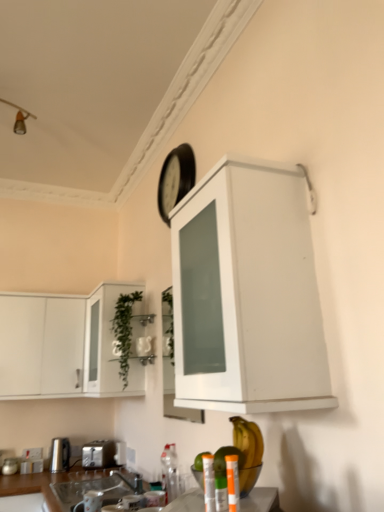
Question: Does green leafy plant at center have a lesser width compared to translucent plastic bottle at lower center, the second bottle viewed from the left?

Choices:
 (A) yes
 (B) no

Answer: (B)

Question: Can you confirm if green leafy plant at center is bigger than translucent plastic bottle at lower center, the 1th bottle viewed from the right?

Choices:
 (A) no
 (B) yes

Answer: (B)

Question: Is green leafy plant at center shorter than translucent plastic bottle at lower center, the 1th bottle viewed from the right?

Choices:
 (A) yes
 (B) no

Answer: (B)

Question: From a real-world perspective, is green leafy plant at center located higher than translucent plastic bottle at lower center, the second bottle viewed from the left?

Choices:
 (A) yes
 (B) no

Answer: (A)

Question: Is green leafy plant at center further to camera compared to translucent plastic bottle at lower center, the second bottle viewed from the left?

Choices:
 (A) no
 (B) yes

Answer: (B)

Question: Is green leafy plant at center not inside translucent plastic bottle at lower center, the 1th bottle viewed from the right?

Choices:
 (A) no
 (B) yes

Answer: (B)

Question: Does silver metallic faucet at lower center appear on the left side of satin silver toaster at lower center, positioned as the 3th appliance in top-to-bottom order?

Choices:
 (A) yes
 (B) no

Answer: (B)

Question: Does silver metallic faucet at lower center have a greater height compared to satin silver toaster at lower center, the 2th appliance when ordered from right to left?

Choices:
 (A) yes
 (B) no

Answer: (B)

Question: Could you tell me if silver metallic faucet at lower center is turned towards satin silver toaster at lower center, the first appliance positioned from the back?

Choices:
 (A) no
 (B) yes

Answer: (A)

Question: Are silver metallic faucet at lower center and satin silver toaster at lower center, the 2th appliance when ordered from right to left, making contact?

Choices:
 (A) no
 (B) yes

Answer: (A)

Question: Could satin silver toaster at lower center, marked as the second appliance in a bottom-to-top arrangement, be considered to be inside silver metallic faucet at lower center?

Choices:
 (A) yes
 (B) no

Answer: (B)

Question: From a real-world perspective, is silver metallic faucet at lower center physically above satin silver toaster at lower center, the 2th appliance when ordered from right to left?

Choices:
 (A) yes
 (B) no

Answer: (B)

Question: Is yellow matte banana at lower center oriented towards metallic silver can at lower center, which is counted as the first bottle, starting from the left?

Choices:
 (A) yes
 (B) no

Answer: (B)